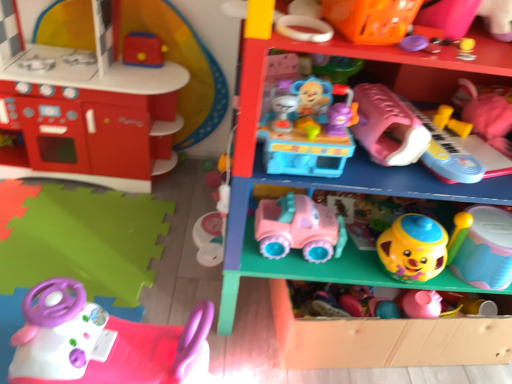
Question: From the image's perspective, is rubberized pink toy piano at right, the eleventh toy in the left-to-right sequence, on top of orange plastic basket at upper right, which is counted as the 7th toy, starting from the right?

Choices:
 (A) yes
 (B) no

Answer: (B)

Question: Can you confirm if rubberized pink toy piano at right, the eleventh toy in the left-to-right sequence, is smaller than orange plastic basket at upper right, which is the 5th toy in left-to-right order?

Choices:
 (A) no
 (B) yes

Answer: (A)

Question: Would you say orange plastic basket at upper right, which is the 5th toy in left-to-right order, is part of rubberized pink toy piano at right, the 1th toy when ordered from right to left,'s contents?

Choices:
 (A) yes
 (B) no

Answer: (B)

Question: Does rubberized pink toy piano at right, the eleventh toy in the left-to-right sequence, have a lesser height compared to orange plastic basket at upper right, which is the 5th toy in left-to-right order?

Choices:
 (A) yes
 (B) no

Answer: (B)

Question: Could you tell me if rubberized pink toy piano at right, the 1th toy when ordered from right to left, is turned towards orange plastic basket at upper right, which is counted as the 7th toy, starting from the right?

Choices:
 (A) no
 (B) yes

Answer: (A)

Question: Does rubberized pink toy piano at right, the 1th toy when ordered from right to left, touch orange plastic basket at upper right, which is the 5th toy in left-to-right order?

Choices:
 (A) yes
 (B) no

Answer: (B)

Question: Could you tell me if pink plastic steering wheel at lower left, which ranks as the third toy in left-to-right order, is turned towards matte red kitchen set at left, the 11th toy viewed from the right?

Choices:
 (A) no
 (B) yes

Answer: (A)

Question: From a real-world perspective, is pink plastic steering wheel at lower left, which ranks as the third toy in left-to-right order, below matte red kitchen set at left, acting as the first toy starting from the left?

Choices:
 (A) no
 (B) yes

Answer: (B)

Question: Is pink plastic steering wheel at lower left, which ranks as the third toy in left-to-right order, at the left side of matte red kitchen set at left, the 11th toy viewed from the right?

Choices:
 (A) no
 (B) yes

Answer: (A)

Question: Considering the relative sizes of pink plastic steering wheel at lower left, which ranks as the third toy in left-to-right order, and matte red kitchen set at left, the 11th toy viewed from the right, in the image provided, is pink plastic steering wheel at lower left, which ranks as the third toy in left-to-right order, bigger than matte red kitchen set at left, the 11th toy viewed from the right,?

Choices:
 (A) yes
 (B) no

Answer: (B)

Question: Considering the relative positions of pink plastic steering wheel at lower left, which ranks as the third toy in left-to-right order, and matte red kitchen set at left, the 11th toy viewed from the right, in the image provided, is pink plastic steering wheel at lower left, which ranks as the third toy in left-to-right order, to the right of matte red kitchen set at left, the 11th toy viewed from the right, from the viewer's perspective?

Choices:
 (A) yes
 (B) no

Answer: (A)

Question: Is pink plastic steering wheel at lower left, which ranks as the third toy in left-to-right order, surrounding matte red kitchen set at left, the 11th toy viewed from the right?

Choices:
 (A) yes
 (B) no

Answer: (B)

Question: From a real-world perspective, is pink plastic steering wheel at lower left, marked as the ninth toy in a right-to-left arrangement, beneath pink plastic toy car at center, which ranks as the 2th shelf in bottom-to-top order?

Choices:
 (A) no
 (B) yes

Answer: (B)